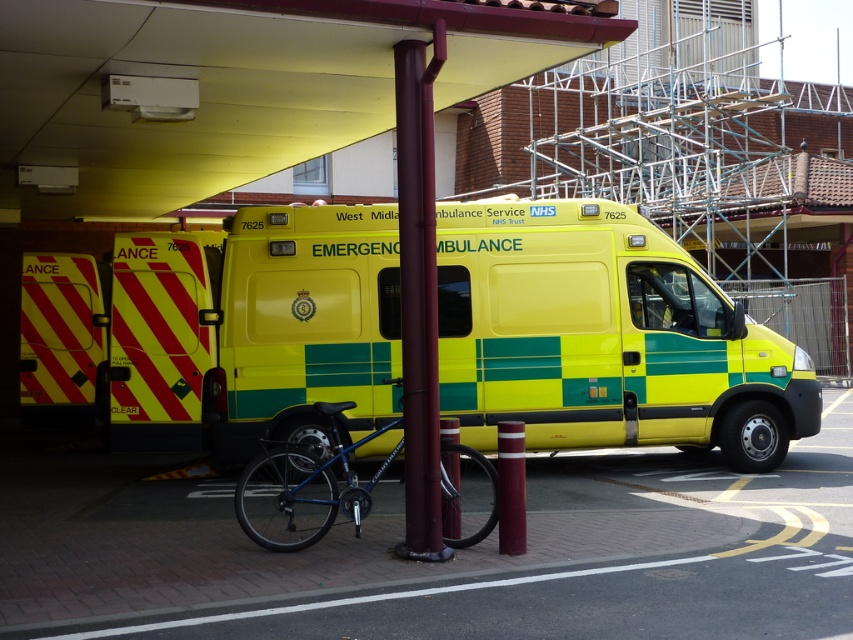
Question: Considering the relative positions of yellow/green checkered emergency vehicle at center and maroon metallic pole at center in the image provided, where is yellow/green checkered emergency vehicle at center located with respect to maroon metallic pole at center?

Choices:
 (A) right
 (B) left

Answer: (B)

Question: Does yellow/green checkered emergency vehicle at center have a smaller size compared to blue metallic bicycle at center?

Choices:
 (A) no
 (B) yes

Answer: (B)

Question: Which point appears closest to the camera in this image?

Choices:
 (A) [x=242, y=428]
 (B) [x=410, y=426]

Answer: (B)

Question: Among these objects, which one is farthest from the camera?

Choices:
 (A) yellow/green checkered emergency vehicle at center
 (B) blue metallic bicycle at center
 (C) maroon metallic pole at center

Answer: (A)

Question: Is yellow/green checkered emergency vehicle at center bigger than maroon metallic pole at center?

Choices:
 (A) yes
 (B) no

Answer: (B)

Question: Among these objects, which one is farthest from the camera?

Choices:
 (A) maroon metallic pole at center
 (B) blue metallic bicycle at center
 (C) yellow/green checkered emergency vehicle at center

Answer: (C)